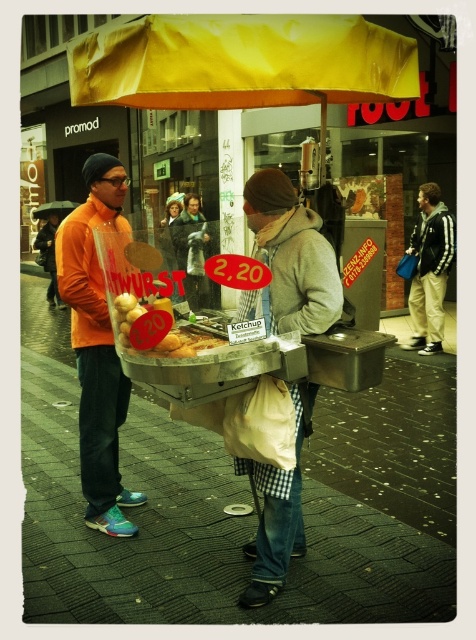
Question: Can you confirm if yellow fabric canopy at upper center is thinner than orange fabric jacket at left?

Choices:
 (A) yes
 (B) no

Answer: (B)

Question: Which object is farther from the camera taking this photo?

Choices:
 (A) orange matte jacket at left
 (B) green wool coat at center
 (C) white fabric bag at center
 (D) yellow fabric canopy at upper center

Answer: (A)

Question: Which of the following is the farthest from the observer?

Choices:
 (A) orange fabric jacket at left
 (B) yellow fabric canopy at upper center

Answer: (A)

Question: Which point is farther from the camera taking this photo?

Choices:
 (A) (442, 288)
 (B) (53, 294)

Answer: (B)

Question: Is yellow fabric canopy at upper center bigger than orange fabric jacket at left?

Choices:
 (A) yes
 (B) no

Answer: (B)

Question: In this image, where is orange matte jacket at left located relative to golden brown bread at center?

Choices:
 (A) left
 (B) right

Answer: (A)